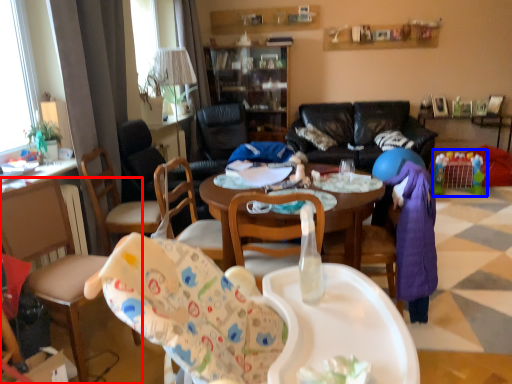
Question: Which object is further to the camera taking this photo, chair (highlighted by a red box) or toy (highlighted by a blue box)?

Choices:
 (A) chair
 (B) toy

Answer: (B)